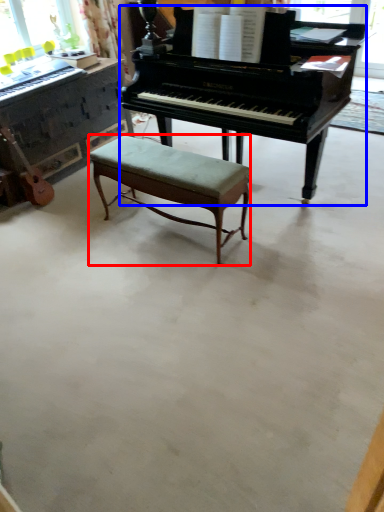
Question: Which object is further to the camera taking this photo, stool (highlighted by a red box) or piano (highlighted by a blue box)?

Choices:
 (A) stool
 (B) piano

Answer: (A)